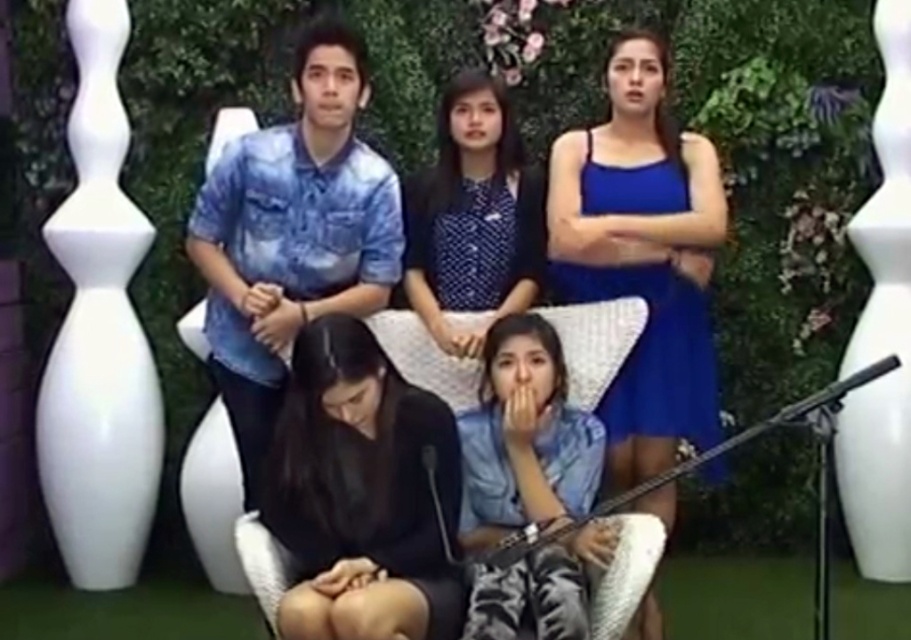
You are organizing a photo shoot and need to ensure that the blue denim shirt at lower center and the polka dot blouse at center are visible in the frame. Given their sizes, which one might require more space in the composition to maintain clarity?

The blue denim shirt at lower center is larger in size compared to the polka dot blouse at center, so it would require more space in the composition to maintain clarity.

You are a photographer at an outdoor event. You need to capture a photo that includes both the blue satin dress at upper right and the black matte dress at lower center. Which dress will appear bigger in the final photo?

The blue satin dress at upper right will appear bigger in the final photo because it has a larger size compared to the black matte dress at lower center.